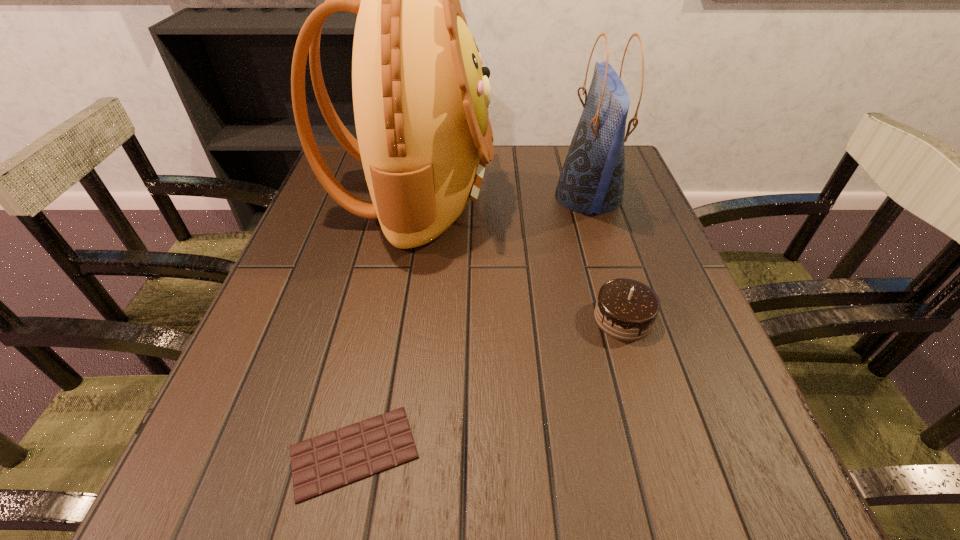
Where is `backpack located at the far edge`? The image size is (960, 540). backpack located at the far edge is located at coordinates (420, 94).

I want to click on shopping bag positioned at the far edge, so click(592, 179).

Locate an element on the screen. object that is at the near edge is located at coordinates (332, 460).

Identify the location of backpack situated at the left edge. Image resolution: width=960 pixels, height=540 pixels. (420, 94).

Identify the location of chocolate bar at the left edge. The width and height of the screenshot is (960, 540). [332, 460].

Identify the location of shopping bag positioned at the right edge. This screenshot has width=960, height=540. click(592, 179).

Find the location of a particular element. This screenshot has width=960, height=540. chocolate cake that is at the right edge is located at coordinates (626, 309).

The height and width of the screenshot is (540, 960). Find the location of `object at the far left corner`. object at the far left corner is located at coordinates (420, 94).

Identify the location of object at the near left corner. The image size is (960, 540). (332, 460).

This screenshot has height=540, width=960. Find the location of `object that is at the far right corner`. object that is at the far right corner is located at coordinates (592, 179).